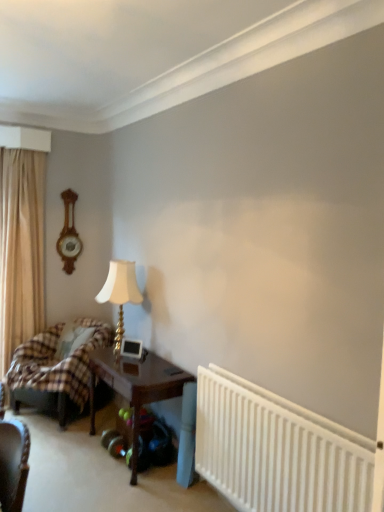
What is the approximate height of plaid fabric bed at left?

plaid fabric bed at left is 30.95 inches in height.

Image resolution: width=384 pixels, height=512 pixels. I want to click on plaid fabric pillow at lower left, so click(x=72, y=339).

The width and height of the screenshot is (384, 512). I want to click on wooden table at center, so click(136, 386).

Is white plastic radiator at lower right far away from wooden table at center?

No, white plastic radiator at lower right is not far away from wooden table at center.

Is white plastic radiator at lower right situated inside wooden table at center or outside?

white plastic radiator at lower right is located beyond the bounds of wooden table at center.

Who is bigger, white plastic radiator at lower right or wooden table at center?

wooden table at center.

Between white plastic radiator at lower right and wooden table at center, which one is positioned in front?

white plastic radiator at lower right is in front.

Is plaid fabric pillow at lower left to the left or to the right of wooden clock at left in the image?

In the image, plaid fabric pillow at lower left appears on the right side of wooden clock at left.

Are plaid fabric pillow at lower left and wooden clock at left located far from each other?

No, plaid fabric pillow at lower left is in close proximity to wooden clock at left.

Considering the positions of point (69, 349) and point (67, 256), is point (69, 349) closer or farther from the camera than point (67, 256)?

Point (69, 349) is positioned closer to the camera compared to point (67, 256).

From the image's perspective, which one is positioned higher, plaid fabric pillow at lower left or wooden clock at left?

→ wooden clock at left is shown above in the image.

In the image, is plaid fabric pillow at lower left positioned in front of or behind white plastic radiator at lower right?

Clearly, plaid fabric pillow at lower left is behind white plastic radiator at lower right.

Is point (63, 342) positioned in front of point (280, 460)?

That is False.

Between plaid fabric pillow at lower left and white plastic radiator at lower right, which one appears on the left side from the viewer's perspective?

plaid fabric pillow at lower left is more to the left.

How many degrees apart are the facing directions of white plastic radiator at lower right and wooden clock at left?

90.2 degrees.

Which object is further away from the camera taking this photo, white plastic radiator at lower right or wooden clock at left?

wooden clock at left is further away from the camera.

Considering the sizes of objects white plastic radiator at lower right and wooden clock at left in the image provided, who is thinner, white plastic radiator at lower right or wooden clock at left?

With smaller width is wooden clock at left.

Locate an element on the screen. This screenshot has width=384, height=512. curtain that appears behind the plaid fabric bed at left is located at coordinates (21, 249).

Can you confirm if plaid fabric bed at left is thinner than beige fabric curtain at left?

In fact, plaid fabric bed at left might be wider than beige fabric curtain at left.

Does point (77, 397) appear closer or farther from the camera than point (11, 182)?

Clearly, point (77, 397) is closer to the camera than point (11, 182).

Is plaid fabric bed at left in front of or behind beige fabric curtain at left in the image?

Visually, plaid fabric bed at left is located in front of beige fabric curtain at left.

Which object is thinner, plaid fabric pillow at lower left or plaid fabric bed at left?

With smaller width is plaid fabric pillow at lower left.

Does plaid fabric pillow at lower left turn towards plaid fabric bed at left?

Yes, plaid fabric pillow at lower left faces towards plaid fabric bed at left.

From a real-world perspective, relative to plaid fabric bed at left, is plaid fabric pillow at lower left vertically above or below?

From a real-world perspective, plaid fabric pillow at lower left is physically above plaid fabric bed at left.

Can you confirm if wooden clock at left is smaller than plaid fabric pillow at lower left?

Correct, wooden clock at left occupies less space than plaid fabric pillow at lower left.

Is wooden clock at left looking in the opposite direction of plaid fabric pillow at lower left?

No, plaid fabric pillow at lower left is not at the back of wooden clock at left.

From a real-world perspective, is wooden clock at left on top of plaid fabric pillow at lower left?

Yes, from a real-world perspective, wooden clock at left is on top of plaid fabric pillow at lower left.

Choose the correct answer: Is wooden clock at left inside plaid fabric pillow at lower left or outside it?

wooden clock at left cannot be found inside plaid fabric pillow at lower left.

Where is `radiator located above the wooden table at center (from the image's perspective)`? The width and height of the screenshot is (384, 512). radiator located above the wooden table at center (from the image's perspective) is located at coordinates (277, 450).

You are a GUI agent. You are given a task and a screenshot of the screen. Output one action in this format:
    pyautogui.click(x=<x>, y=<y>)
    Task: Click on the pillow that appears below the wooden clock at left (from the image's perspective)
    
    Given the screenshot: What is the action you would take?
    pyautogui.click(x=72, y=339)

When comparing their distances from plaid fabric pillow at lower left, does beige fabric curtain at left or plaid fabric bed at left seem further?

beige fabric curtain at left is positioned further to the anchor plaid fabric pillow at lower left.

Looking at the image, which one is located closer to plaid fabric bed at left, plaid fabric pillow at lower left or white plastic radiator at lower right?

The object closer to plaid fabric bed at left is plaid fabric pillow at lower left.

From the image, which object appears to be farther from beige fabric curtain at left, plaid fabric pillow at lower left or wooden clock at left?

The object further to beige fabric curtain at left is plaid fabric pillow at lower left.

Looking at the image, which one is located further to wooden clock at left, beige fabric curtain at left or gold metallic table lamp at center-left?

Among the two, gold metallic table lamp at center-left is located further to wooden clock at left.

From the image, which object appears to be nearer to plaid fabric bed at left, white plastic radiator at lower right or beige fabric curtain at left?

The object closer to plaid fabric bed at left is beige fabric curtain at left.

Considering their positions, is wooden table at center positioned further to beige fabric curtain at left than plaid fabric bed at left?

wooden table at center.

Estimate the real-world distances between objects in this image. Which object is further from wooden clock at left, plaid fabric pillow at lower left or beige fabric curtain at left?

plaid fabric pillow at lower left is positioned further to the anchor wooden clock at left.

Looking at the image, which one is located closer to gold metallic table lamp at center-left, plaid fabric bed at left or white plastic radiator at lower right?

plaid fabric bed at left is positioned closer to the anchor gold metallic table lamp at center-left.

Locate an element on the screen. pillow located between beige fabric curtain at left and wooden table at center in the left-right direction is located at coordinates (72, 339).

Locate an element on the screen. The width and height of the screenshot is (384, 512). bed located between beige fabric curtain at left and wooden table at center in the left-right direction is located at coordinates (54, 370).

Locate an element on the screen. This screenshot has width=384, height=512. table lamp located between white plastic radiator at lower right and plaid fabric pillow at lower left in the depth direction is located at coordinates (120, 293).

At what (x,y) coordinates should I click in order to perform the action: click on curtain positioned between wooden table at center and wooden clock at left from near to far. Please return your answer as a coordinate pair (x, y). Looking at the image, I should click on (21, 249).